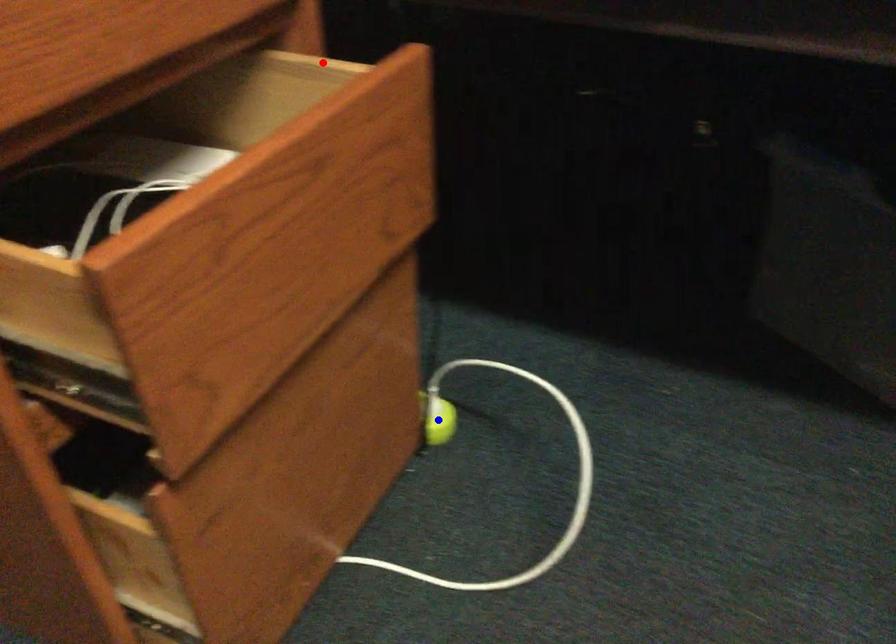
Question: In the image, two points are highlighted. Which point is nearer to the camera? Reply with the corresponding letter.

Choices:
 (A) blue point
 (B) red point

Answer: (B)